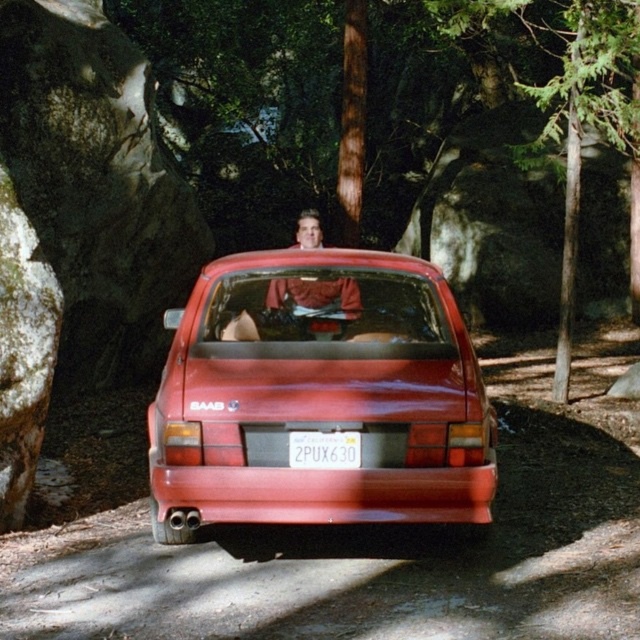
In the scene shown: You are a photographer trying to capture the license plate details of the white plastic license plate at center while also including the smooth leather jacket at center in the frame. Since both are at the center, which object will appear larger in your photo?

The smooth leather jacket at center will appear larger in the photo because it is bigger than the white plastic license plate at center.

You are a photographer trying to capture the white plastic license plate at center while avoiding the glossy red car at center. Can you move to the right side of the license plate to take the photo?

The glossy red car at center is to the left of the white plastic license plate at center, so moving to the right side of the license plate would place you away from the car, allowing you to take the photo without obstruction.